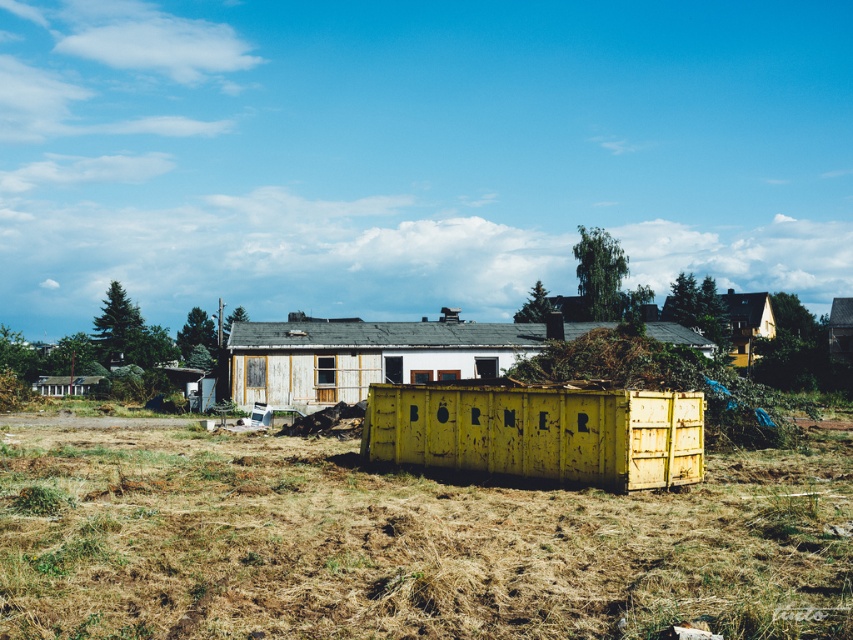
Question: Based on their relative distances, which object is nearer to the yellow weathered container at center?

Choices:
 (A) dry grass at center
 (B) wooden hut at upper right

Answer: (A)

Question: Does yellow weathered container at center appear under wooden hut at left?

Choices:
 (A) yes
 (B) no

Answer: (B)

Question: From the image, what is the correct spatial relationship of yellow weathered container at center in relation to wooden hut at upper right?

Choices:
 (A) below
 (B) above

Answer: (A)

Question: Does dry grass at center appear under wooden hut at upper right?

Choices:
 (A) no
 (B) yes

Answer: (B)

Question: Considering the real-world distances, which object is closest to the yellow weathered container at center?

Choices:
 (A) wooden hut at upper right
 (B) wooden hut at left
 (C) rusty yellow container at center
 (D) dry grass at center

Answer: (D)

Question: Which object is positioned farthest from the wooden hut at left?

Choices:
 (A) rusty yellow container at center
 (B) wooden hut at upper right
 (C) yellow weathered container at center

Answer: (A)